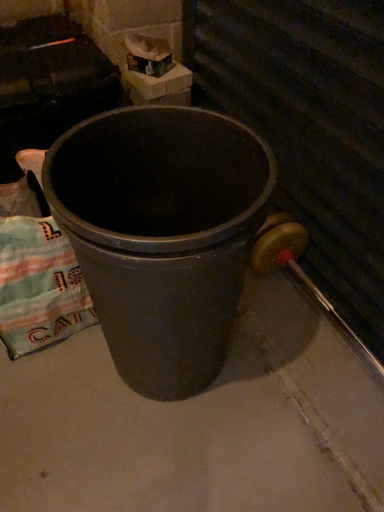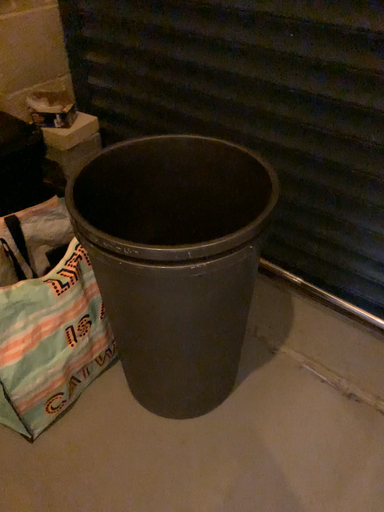
Question: How did the camera likely rotate when shooting the video?

Choices:
 (A) rotated upward
 (B) rotated downward

Answer: (A)